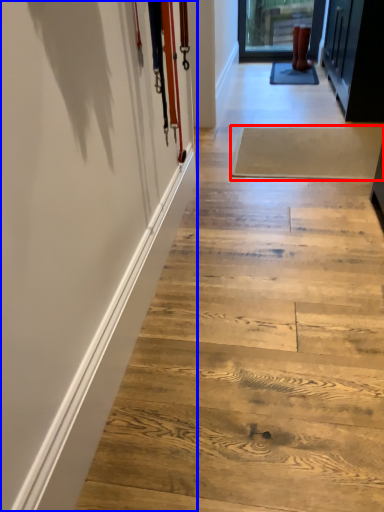
Question: Among these objects, which one is farthest to the camera, plank (highlighted by a red box) or barn door (highlighted by a blue box)?

Choices:
 (A) plank
 (B) barn door

Answer: (A)